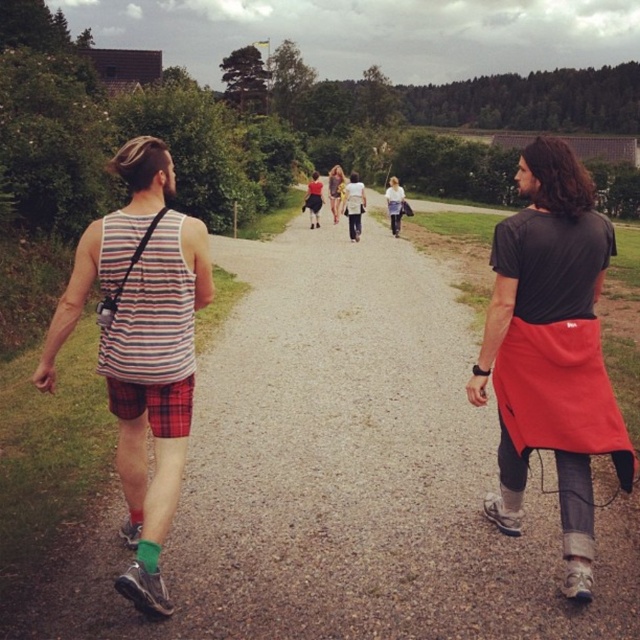
Where is `striped fabric tank top at left`? This screenshot has width=640, height=640. striped fabric tank top at left is located at coordinates (141, 346).

Who is lower down, striped fabric tank top at left or light blue denim jeans at center?

striped fabric tank top at left is lower down.

Is point (148, 552) less distant than point (392, 216)?

Yes, point (148, 552) is in front of point (392, 216).

Locate an element on the screen. The height and width of the screenshot is (640, 640). striped fabric tank top at left is located at coordinates (141, 346).

Is red fabric apron at right thinner than matte black tank top at center?

Incorrect, red fabric apron at right's width is not less than matte black tank top at center's.

Between red fabric apron at right and matte black tank top at center, which one appears on the right side from the viewer's perspective?

red fabric apron at right is more to the right.

In order to click on red fabric apron at right in this screenshot , I will do `click(552, 349)`.

Does light blue denim jeans at center appear on the left side of matte black tank top at center?

Incorrect, light blue denim jeans at center is not on the left side of matte black tank top at center.

Is point (396, 196) farther from camera compared to point (337, 198)?

No, (396, 196) is in front of (337, 198).

Find the location of a particular element. The height and width of the screenshot is (640, 640). light blue denim jeans at center is located at coordinates (394, 204).